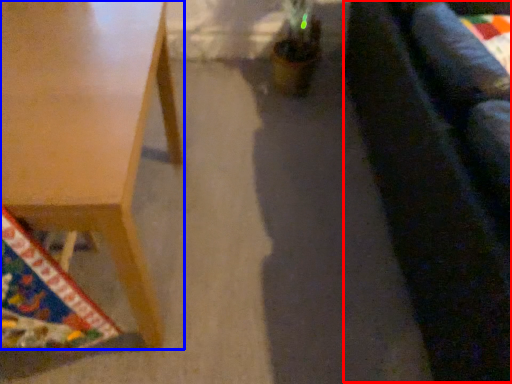
Question: Which point is closer to the camera, couch (highlighted by a red box) or table (highlighted by a blue box)?

Choices:
 (A) couch
 (B) table

Answer: (A)